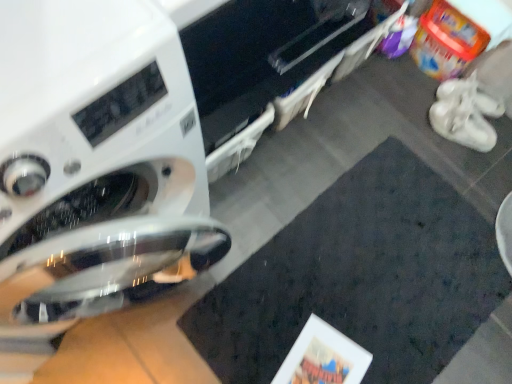
The height and width of the screenshot is (384, 512). I want to click on vacant space in front of white matte shoe at right, so click(x=469, y=155).